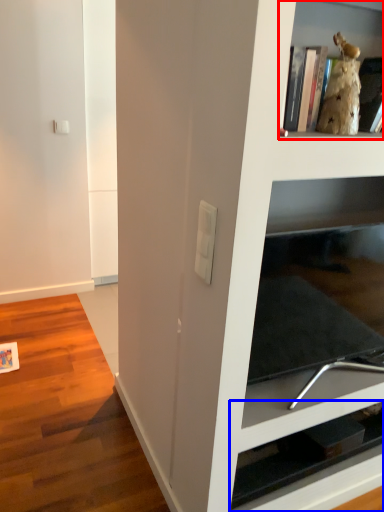
Question: Which point is closer to the camera, shelf (highlighted by a red box) or shelf (highlighted by a blue box)?

Choices:
 (A) shelf
 (B) shelf

Answer: (A)